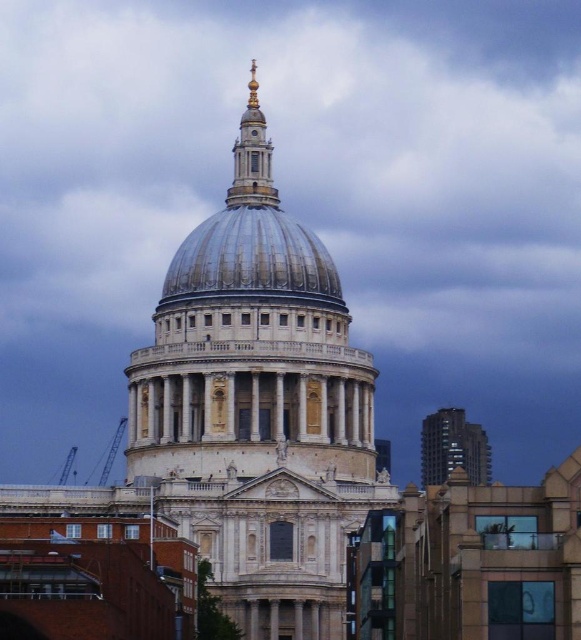
Which is below, white marble dome at center or gold polished metal spire at upper center?

white marble dome at center is below.

Is white marble dome at center thinner than gold polished metal spire at upper center?

No.

Measure the distance between point (156, 406) and camera.

Point (156, 406) is 378.10 feet from camera.

Where is `white marble dome at center`? This screenshot has width=581, height=640. white marble dome at center is located at coordinates (259, 406).

Who is positioned more to the right, shiny metallic dome at center or gold polished metal spire at upper center?

From the viewer's perspective, shiny metallic dome at center appears more on the right side.

Can you confirm if shiny metallic dome at center is bigger than gold polished metal spire at upper center?

No.

Is point (181, 257) positioned after point (245, 189)?

No, (181, 257) is in front of (245, 189).

I want to click on shiny metallic dome at center, so click(252, 260).

Based on the photo, is shiny metallic dome at center further to camera compared to glassy reflective skyscraper at right?

That is False.

Between shiny metallic dome at center and glassy reflective skyscraper at right, which one appears on the left side from the viewer's perspective?

Positioned to the left is shiny metallic dome at center.

What do you see at coordinates (252, 260) in the screenshot? The height and width of the screenshot is (640, 581). I see `shiny metallic dome at center` at bounding box center [252, 260].

You are a GUI agent. You are given a task and a screenshot of the screen. Output one action in this format:
    pyautogui.click(x=<x>, y=<y>)
    Task: Click on the shiny metallic dome at center
    The image size is (581, 640).
    Given the screenshot: What is the action you would take?
    pyautogui.click(x=252, y=260)